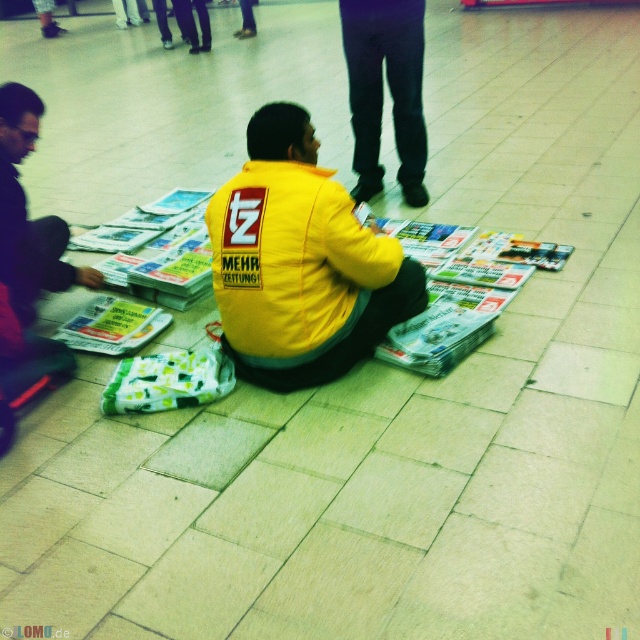
What do you see at coordinates (300, 262) in the screenshot? This screenshot has width=640, height=640. I see `yellow matte jacket at center` at bounding box center [300, 262].

Is yellow matte jacket at center to the left of matte black jacket at left from the viewer's perspective?

Incorrect, yellow matte jacket at center is not on the left side of matte black jacket at left.

Is point (336, 198) closer to viewer compared to point (3, 179)?

Yes, point (336, 198) is in front of point (3, 179).

Find the location of a particular element. yellow matte jacket at center is located at coordinates (300, 262).

Based on the photo, can you confirm if yellow matte jacket at center is thinner than green glossy magazine at center?

In fact, yellow matte jacket at center might be wider than green glossy magazine at center.

From the picture: Which of these two, yellow matte jacket at center or green glossy magazine at center, stands shorter?

green glossy magazine at center

Where is `yellow matte jacket at center`? The width and height of the screenshot is (640, 640). yellow matte jacket at center is located at coordinates (300, 262).

Between dark blue jeans at center and matte black jacket at left, which one has less height?

matte black jacket at left

Can you confirm if dark blue jeans at center is positioned to the right of matte black jacket at left?

Yes, dark blue jeans at center is to the right of matte black jacket at left.

The height and width of the screenshot is (640, 640). Identify the location of dark blue jeans at center. (381, 90).